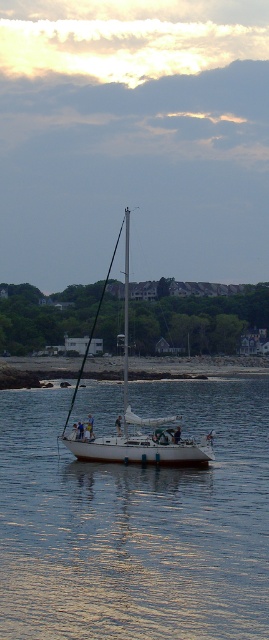
Question: Based on their relative distances, which object is nearer to the smooth sand at lower center?

Choices:
 (A) white glossy mast at center
 (B) white smooth water at center
 (C) white matte sailboat at center

Answer: (C)

Question: Can you confirm if smooth sand at lower center is positioned to the right of white glossy mast at center?

Choices:
 (A) yes
 (B) no

Answer: (A)

Question: Can you confirm if white smooth water at center is thinner than white glossy mast at center?

Choices:
 (A) yes
 (B) no

Answer: (B)

Question: Which is nearer to the white smooth water at center?

Choices:
 (A) white matte sailboat at center
 (B) smooth sand at lower center

Answer: (A)

Question: Among these points, which one is farthest from the camera?

Choices:
 (A) (259, 460)
 (B) (167, 374)
 (C) (125, 400)
 (D) (86, 452)

Answer: (B)

Question: Is white matte sailboat at center to the left of smooth sand at lower center from the viewer's perspective?

Choices:
 (A) yes
 (B) no

Answer: (A)